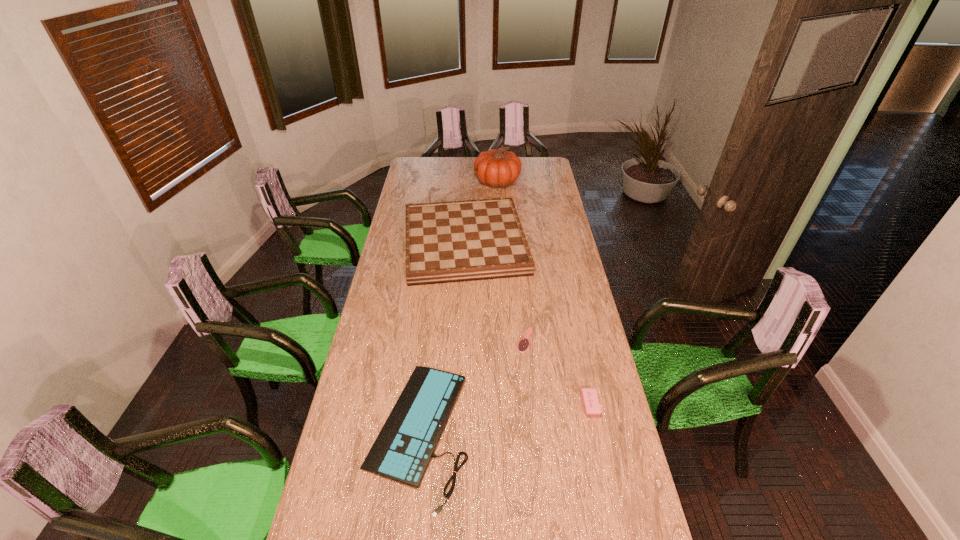
Image resolution: width=960 pixels, height=540 pixels. I want to click on free point between the rightmost object and the fourth shortest object, so click(527, 323).

Where is `vacant space that's between the third nearest object and the second shortest object`? vacant space that's between the third nearest object and the second shortest object is located at coordinates (471, 386).

Locate an element on the screen. The width and height of the screenshot is (960, 540). blank region between the computer keyboard and the shortest object is located at coordinates (471, 386).

Identify the location of free space between the eraser and the fourth tallest object. (504, 418).

Identify which object is the third closest to the hairbrush. Please provide its 2D coordinates. Your answer should be formatted as a tuple, i.e. [(x, y)], where the tuple contains the x and y coordinates of a point satisfying the conditions above.

[(457, 241)]

Select which object is the third closest to the third farthest object. Please provide its 2D coordinates. Your answer should be formatted as a tuple, i.e. [(x, y)], where the tuple contains the x and y coordinates of a point satisfying the conditions above.

[(457, 241)]

The width and height of the screenshot is (960, 540). What are the coordinates of `vacant position in the image that satisfies the following two spatial constraints: 1. on the face of the shortest object; 2. on the left side of the tallest object` in the screenshot? It's located at (507, 340).

Locate an element on the screen. free space that satisfies the following two spatial constraints: 1. on the face of the farthest object; 2. on the left side of the third shortest object is located at coordinates (510, 404).

The width and height of the screenshot is (960, 540). In order to click on free location that satisfies the following two spatial constraints: 1. on the back side of the fourth tallest object; 2. on the right side of the hairbrush in this screenshot , I will do `click(429, 340)`.

The height and width of the screenshot is (540, 960). In order to click on free location that satisfies the following two spatial constraints: 1. on the face of the farthest object; 2. on the back side of the hairbrush in this screenshot , I will do `click(507, 340)`.